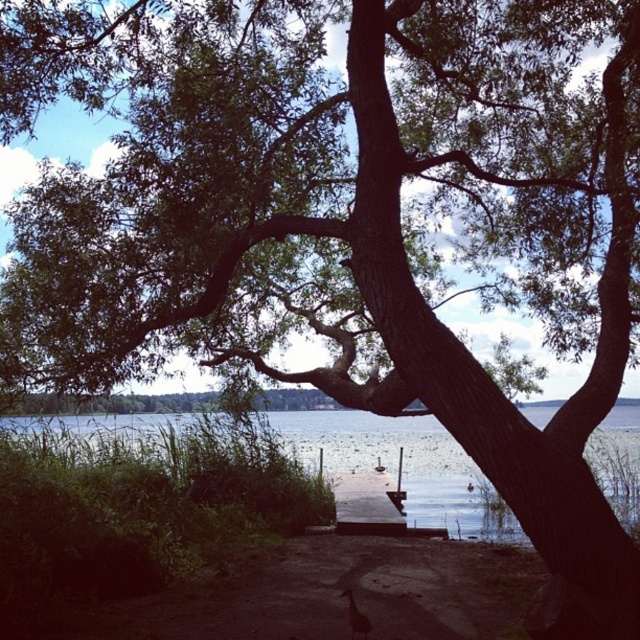
You are a kayaker planning to paddle across the lake shown in the image. You see a point marked at coordinates (404, 467). What is the nature of the water at that location?

The point at (404, 467) indicates clear water at center, so the water there is clear and suitable for safe passage.